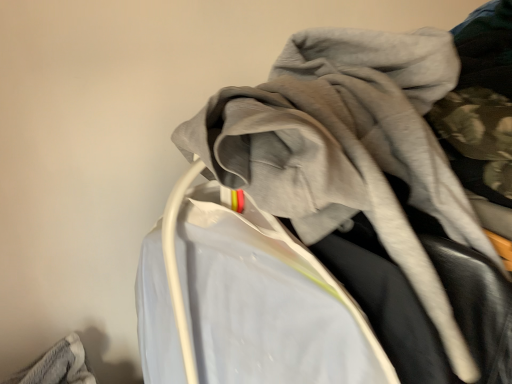
Identify the location of gray cotton jacket at center. (350, 153).

The height and width of the screenshot is (384, 512). What do you see at coordinates (350, 153) in the screenshot?
I see `gray cotton jacket at center` at bounding box center [350, 153].

I want to click on gray cotton jacket at center, so click(x=350, y=153).